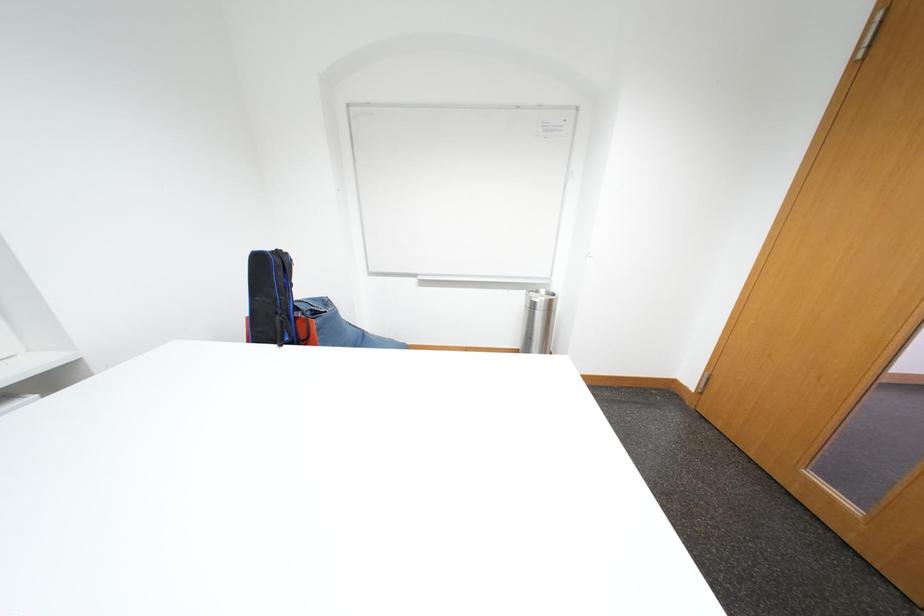
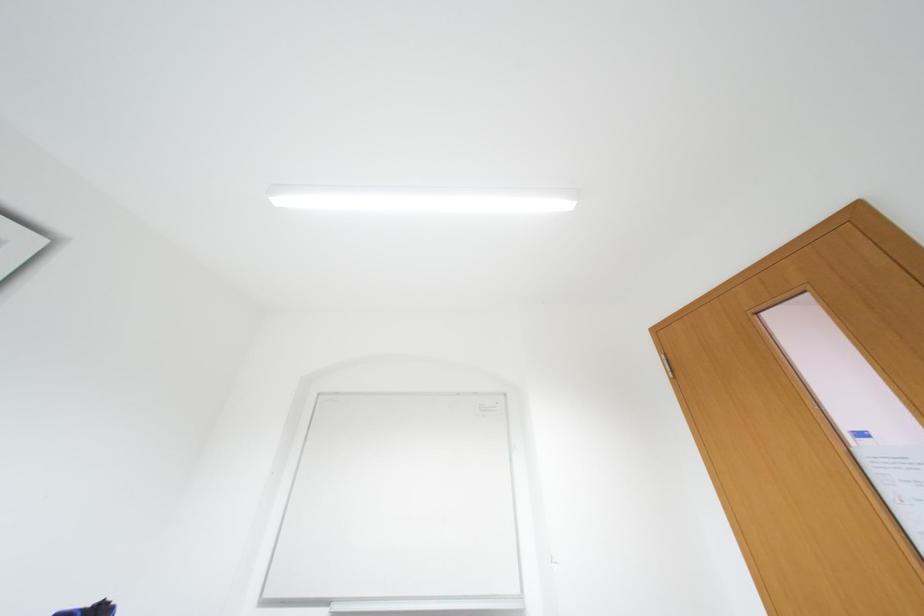
Question: The images are taken continuously from a first-person perspective. In which direction is your viewpoint rotating?

Choices:
 (A) Left
 (B) Right
 (C) Up
 (D) Down

Answer: (C)